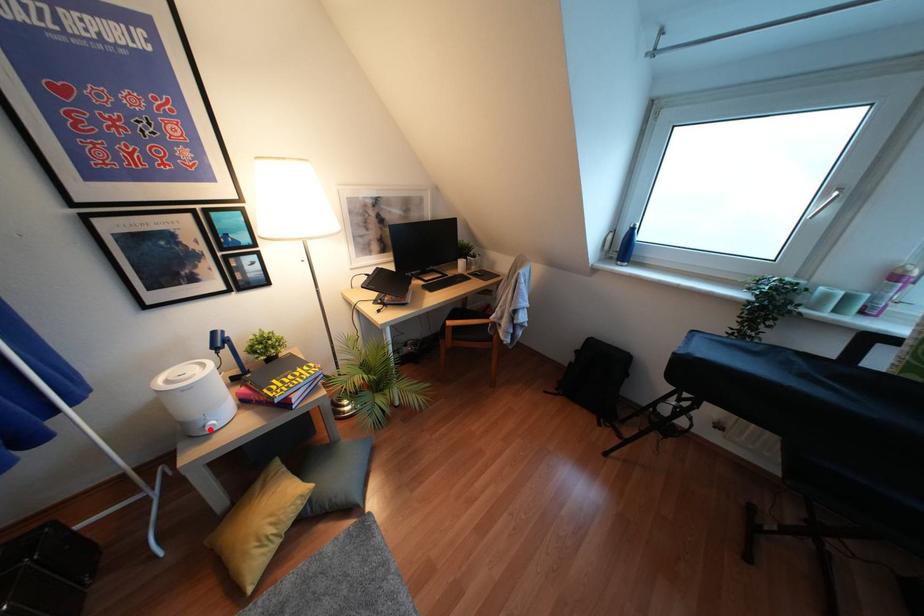
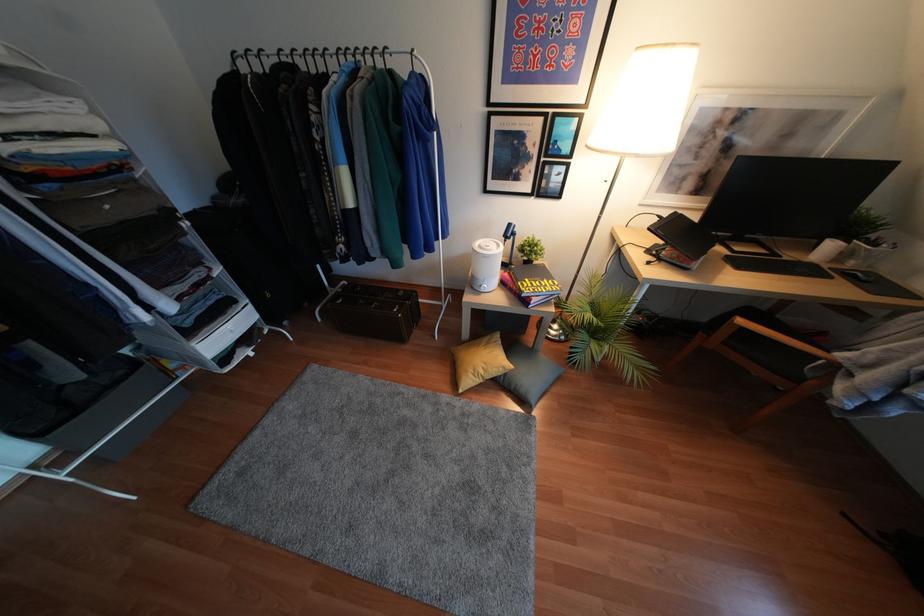
Find the pixel in the second image that matches the highlighted location in the first image.

(481, 290)